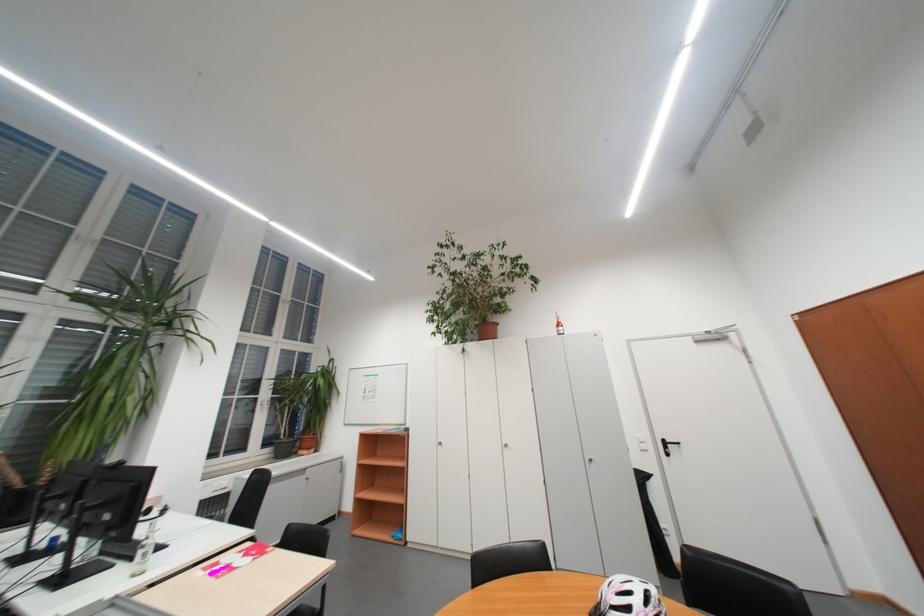
The width and height of the screenshot is (924, 616). In order to click on black door handle in this screenshot , I will do `click(667, 446)`.